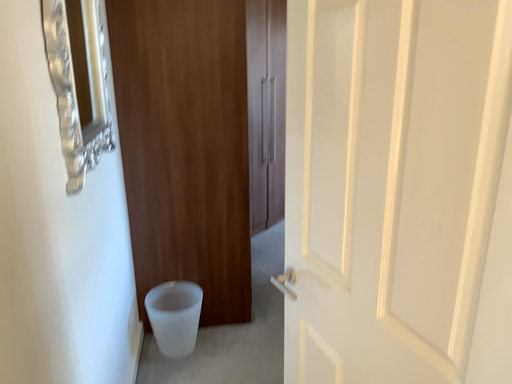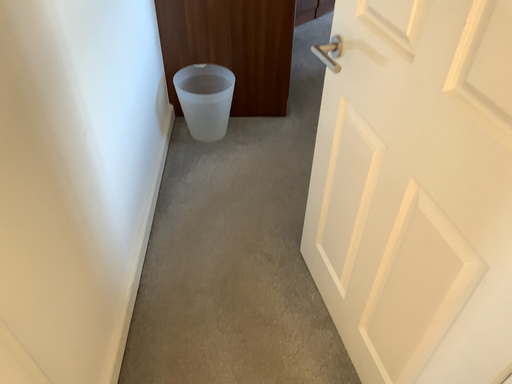
Question: Which way did the camera rotate in the video?

Choices:
 (A) rotated right
 (B) rotated left

Answer: (B)